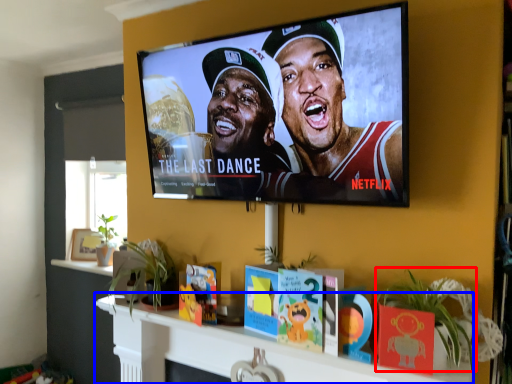
Question: Among these objects, which one is farthest to the camera, plant (highlighted by a red box) or shelf (highlighted by a blue box)?

Choices:
 (A) plant
 (B) shelf

Answer: (B)